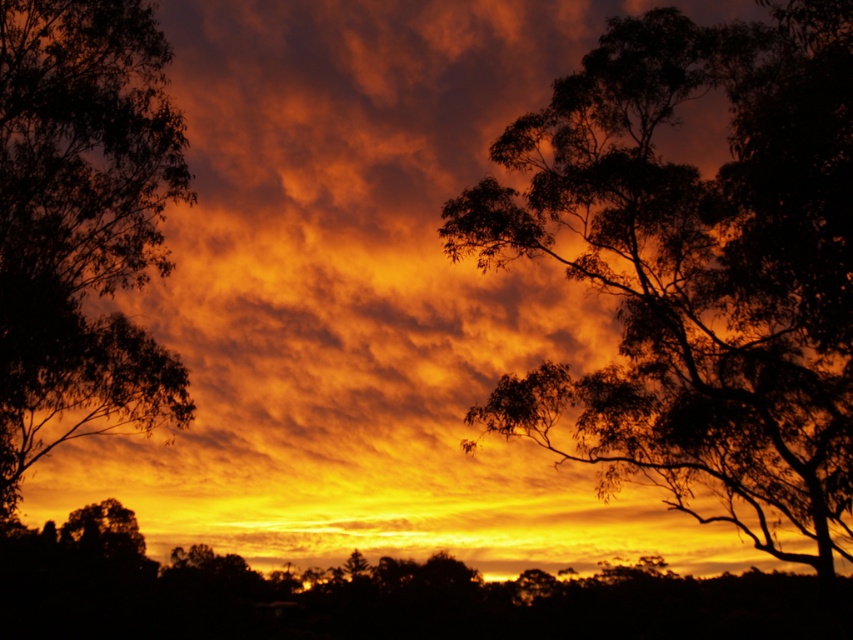
Can you confirm if dark green leafy tree at center is taller than silhouette leafy tree at left?

Indeed, dark green leafy tree at center has a greater height compared to silhouette leafy tree at left.

Can you confirm if dark green leafy tree at center is positioned below silhouette leafy tree at left?

Yes, dark green leafy tree at center is below silhouette leafy tree at left.

Where is `dark green leafy tree at center`? This screenshot has width=853, height=640. dark green leafy tree at center is located at coordinates (697, 268).

The image size is (853, 640). Find the location of `dark green leafy tree at center`. dark green leafy tree at center is located at coordinates point(697,268).